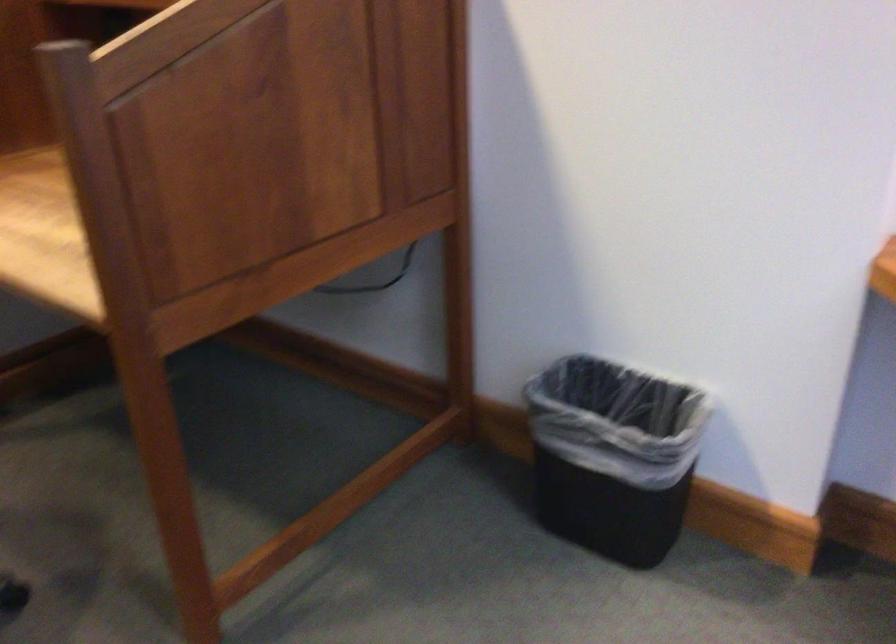
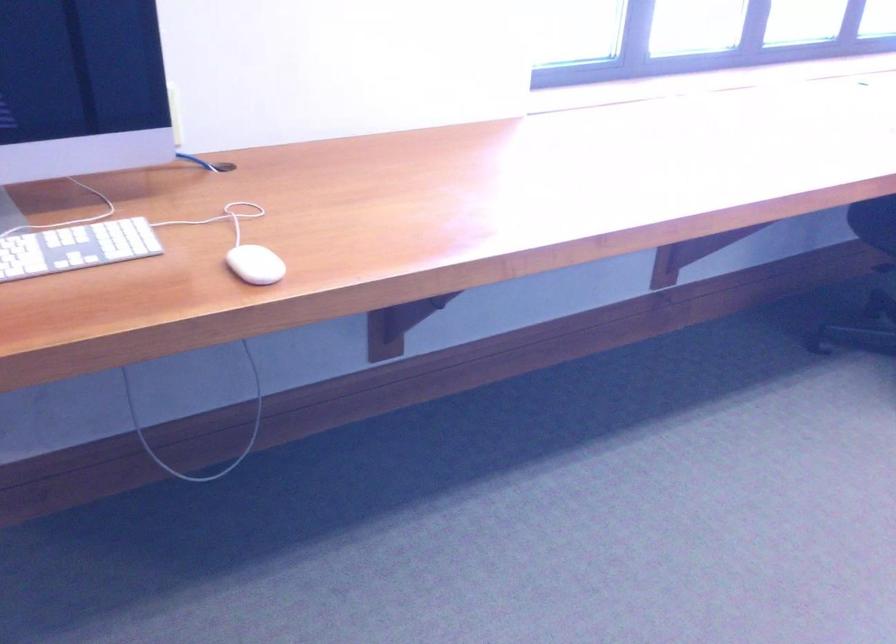
Based on the photo, first-person continuous shooting, in which direction is the camera rotating?

The rotation direction of the camera is right-down.